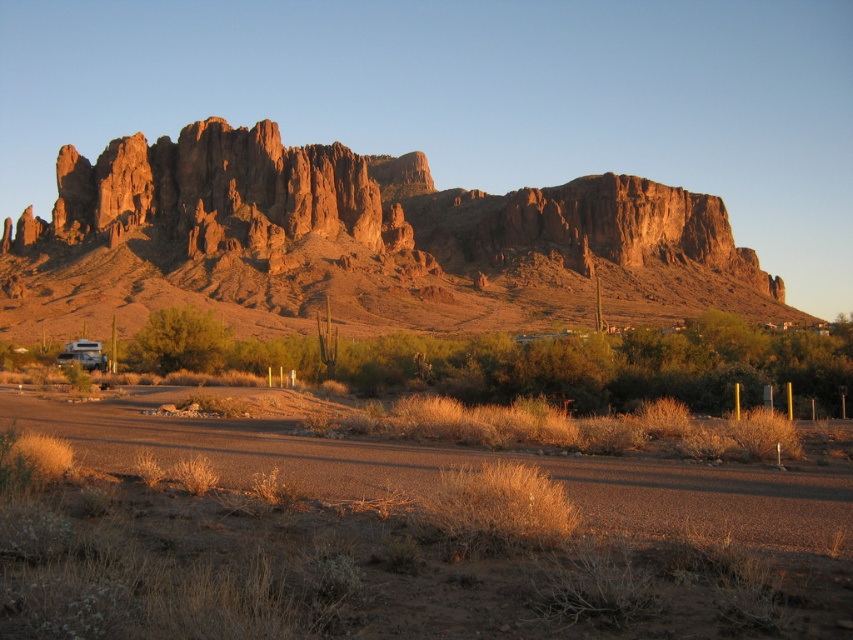
Question: Which object is positioned closest to the rustic rock formation at upper center?

Choices:
 (A) dry grass at center
 (B) matte silver rv at lower left

Answer: (B)

Question: Which of the following is the closest to the observer?

Choices:
 (A) (691, 509)
 (B) (74, 358)
 (C) (265, 298)

Answer: (A)

Question: Does rustic rock formation at upper center appear on the left side of matte silver rv at lower left?

Choices:
 (A) no
 (B) yes

Answer: (A)

Question: Which point appears closest to the camera in this image?

Choices:
 (A) (589, 234)
 (B) (445, 481)
 (C) (77, 349)

Answer: (B)

Question: Does dry grass at center have a smaller size compared to matte silver rv at lower left?

Choices:
 (A) yes
 (B) no

Answer: (B)

Question: Can you confirm if rustic rock formation at upper center is positioned to the right of matte silver rv at lower left?

Choices:
 (A) yes
 (B) no

Answer: (A)